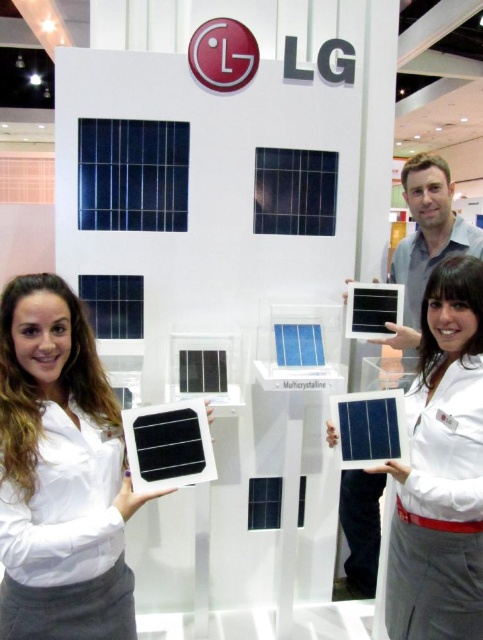
Question: Does matte black solar panel at center appear on the right side of blue crystalline solar panel at upper center?

Choices:
 (A) yes
 (B) no

Answer: (A)

Question: Is matte black solar panel at left to the right of blue crystalline solar panel at center from the viewer's perspective?

Choices:
 (A) yes
 (B) no

Answer: (B)

Question: Is blue crystalline solar panel at upper center positioned before blue crystalline solar panel at center?

Choices:
 (A) no
 (B) yes

Answer: (B)

Question: Which point is closer to the camera taking this photo?

Choices:
 (A) (133, 125)
 (B) (274, 161)
 (C) (128, 333)

Answer: (A)

Question: Which object is the farthest from the blue crystalline solar panel at center?

Choices:
 (A) blue crystalline solar panel at upper center
 (B) semi-glossy blue solar panel at center
 (C) matte black solar panel at center

Answer: (C)

Question: Which object is closer to the camera taking this photo?

Choices:
 (A) matte black solar panel at center
 (B) blue crystalline solar panel at center
 (C) matte black solar panel at left
 (D) blue crystalline solar panel at upper center

Answer: (C)